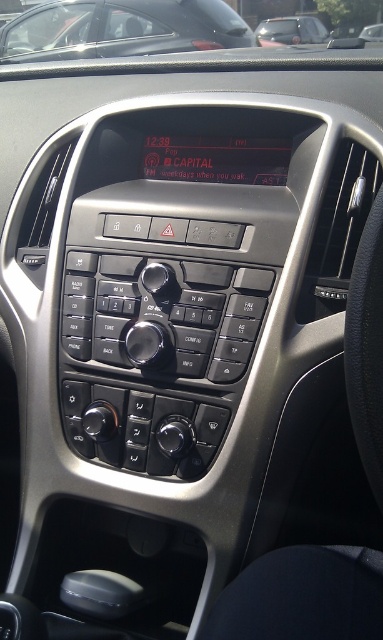
You are a car designer reviewing the dashboard layout. You notice two cars labeled metallic gray car at upper center and metallic silver car at upper center. Which car has a taller console display?

The metallic gray car at upper center has a taller console display than the metallic silver car at upper center according to the description.

You are sitting in the driver seat of the car and want to reach the point at coordinates point (188,36). If your arm can extend 6 feet, can you comfortably reach it?

The distance of point (188,36) from viewer is 7.56 feet, which is beyond your arm extension of 6 feet. You cannot comfortably reach it.

You are a passenger in the car and want to locate the metallic gray car at upper center. Where would you look on the dashboard?

The metallic gray car at upper center is located at the dashboard coordinates point (121, 28).